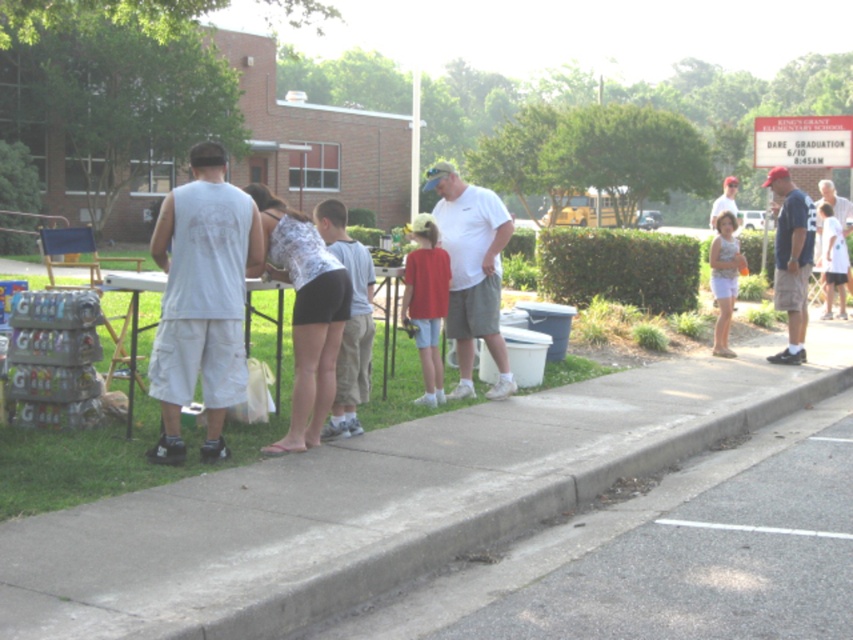
Does white cotton tank top at center have a lesser width compared to white cotton shirt at upper right?

Yes, white cotton tank top at center is thinner than white cotton shirt at upper right.

Is white cotton tank top at center behind white cotton shirt at upper right?

No, white cotton tank top at center is closer to the viewer.

Is point (225, 193) behind point (828, 284)?

That is False.

Find the location of a particular element. The width and height of the screenshot is (853, 640). white cotton tank top at center is located at coordinates (201, 300).

Is light brown shorts at center positioned in front of dark blue t-shirt at right?

Yes, light brown shorts at center is closer to the viewer.

Between light brown shorts at center and dark blue t-shirt at right, which one appears on the right side from the viewer's perspective?

dark blue t-shirt at right is more to the right.

Who is more forward, (340, 340) or (776, 269)?

Point (340, 340) is more forward.

Image resolution: width=853 pixels, height=640 pixels. What are the coordinates of `light brown shorts at center` in the screenshot? It's located at point(347,321).

Who is lower down, matte pink shirt at right or matte white shirt at center?

matte pink shirt at right is lower down.

Does matte pink shirt at right have a lesser width compared to matte white shirt at center?

Yes, matte pink shirt at right is thinner than matte white shirt at center.

Who is more forward, (722, 280) or (737, 182)?

Point (722, 280) is more forward.

Image resolution: width=853 pixels, height=640 pixels. I want to click on matte pink shirt at right, so click(724, 278).